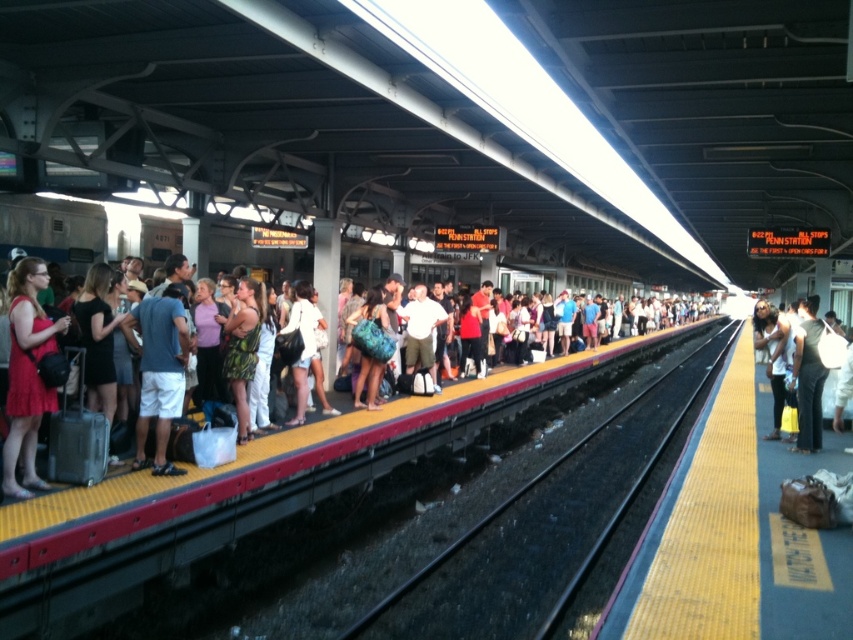
Between point (679, 428) and point (248, 307), which one is positioned behind?

Positioned behind is point (679, 428).

Can you confirm if black asphalt train track at center is taller than matte black crowd at left?

Incorrect, black asphalt train track at center's height is not larger of matte black crowd at left's.

Locate an element on the screen. The image size is (853, 640). black asphalt train track at center is located at coordinates (546, 525).

Does black asphalt train track at center come behind matte black bag at right?

That is False.

Does black asphalt train track at center have a lesser height compared to matte black bag at right?

Correct, black asphalt train track at center is not as tall as matte black bag at right.

The width and height of the screenshot is (853, 640). I want to click on black asphalt train track at center, so click(546, 525).

Identify the location of black asphalt train track at center. (546, 525).

Is matte black crowd at left smaller than matte black bag at right?

Actually, matte black crowd at left might be larger than matte black bag at right.

Describe the element at coordinates (22, 433) in the screenshot. I see `matte black crowd at left` at that location.

Between point (9, 282) and point (807, 422), which one is positioned behind?

Positioned behind is point (807, 422).

The image size is (853, 640). Identify the location of matte black crowd at left. (22, 433).